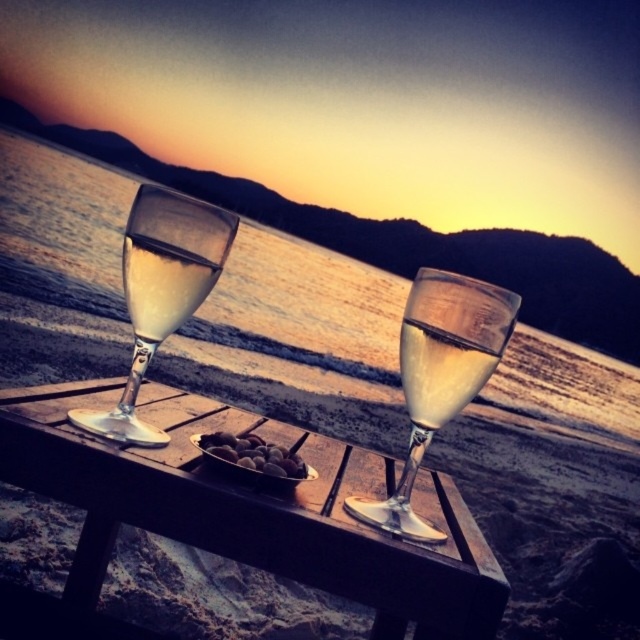
You are a photographer holding a camera and want to capture a closeup shot of the wooden table at center. You are currently positioned 12 inches away from the table. Should you move closer or farther away to achieve the desired closeup?

The wooden table at center is 12.31 inches away from the camera. Since you are currently 12 inches away, you should move slightly farther away to match the required distance of 12.31 inches for the closeup.

You are a waiter at a lakeside restaurant and need to place a dessert plate between the transparent glass water at center and the clear glass wine glass at left. The plate is 10 inches wide. Can you fit it between them without moving the existing glasses?

The transparent glass water at center and the clear glass wine glass at left are 10.57 inches apart from each other. Since the dessert plate is 10 inches wide, it can fit between them as the space is slightly wider than the plate.